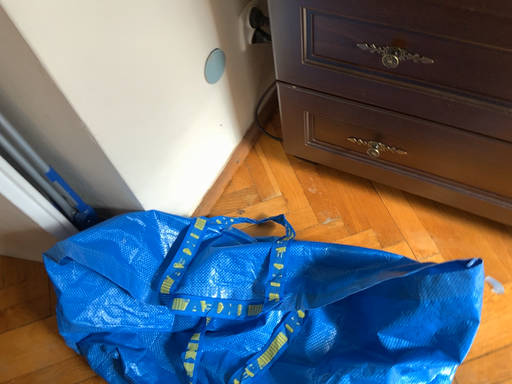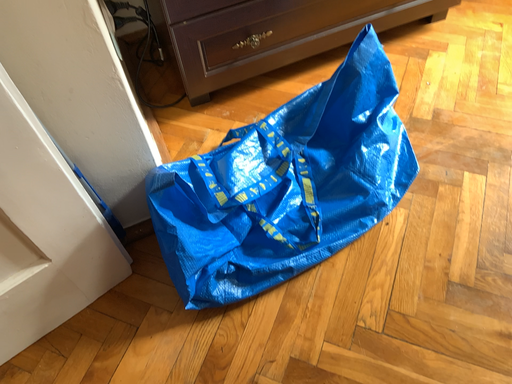
Question: Which way did the camera rotate in the video?

Choices:
 (A) rotated downward
 (B) rotated upward

Answer: (B)